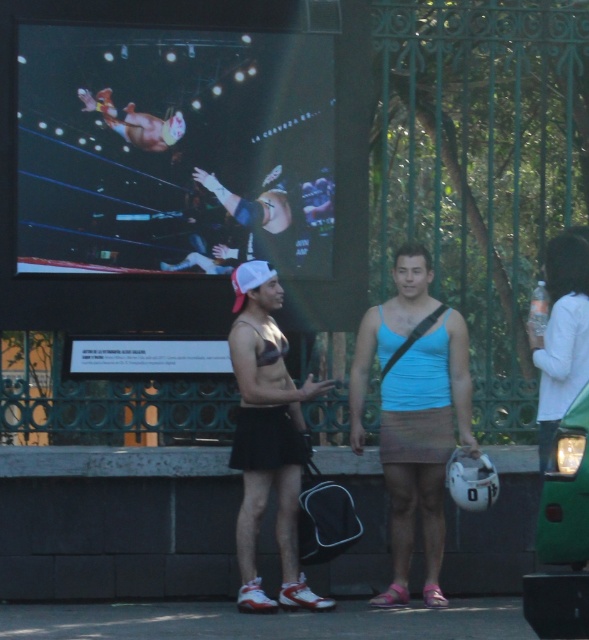
Question: From the image, what is the correct spatial relationship of matte black screen at upper center in relation to white cotton shirt at right?

Choices:
 (A) above
 (B) below

Answer: (A)

Question: Which is nearer to the light blue tank top at center?

Choices:
 (A) matte black screen at upper center
 (B) white cotton shirt at right

Answer: (B)

Question: Can you confirm if black matte shorts at center is positioned above white cotton shirt at right?

Choices:
 (A) yes
 (B) no

Answer: (B)

Question: In this image, where is light blue tank top at center located relative to black matte shorts at center?

Choices:
 (A) right
 (B) left

Answer: (A)

Question: Among these objects, which one is farthest from the camera?

Choices:
 (A) matte black screen at upper center
 (B) white cotton shirt at right

Answer: (A)

Question: Which point is farther to the camera?

Choices:
 (A) black matte shorts at center
 (B) light blue tank top at center

Answer: (B)